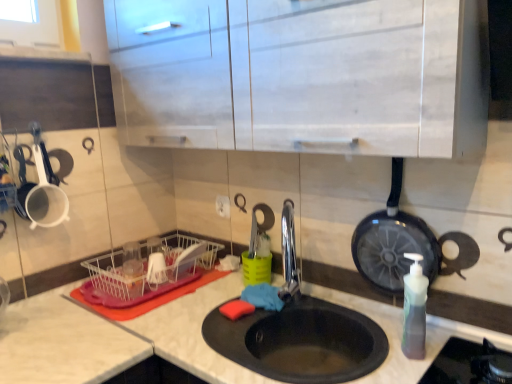
Question: Is polished chrome faucet at center bigger or smaller than clear plastic dish rack at lower left?

Choices:
 (A) small
 (B) big

Answer: (A)

Question: From a real-world perspective, relative to clear plastic dish rack at lower left, is polished chrome faucet at center vertically above or below?

Choices:
 (A) above
 (B) below

Answer: (A)

Question: Which object is the closest to the polished chrome faucet at center?

Choices:
 (A) black non-stick frying pan at right
 (B) clear plastic dish rack at lower left
 (C) translucent plastic soap dispenser at right
 (D) white matte cabinet at upper center
 (E) black matte sink at center

Answer: (E)

Question: Considering the real-world distances, which object is closest to the polished chrome faucet at center?

Choices:
 (A) translucent plastic soap dispenser at right
 (B) black matte sink at center
 (C) black non-stick frying pan at right
 (D) white matte cabinet at upper center
 (E) clear plastic dish rack at lower left

Answer: (B)